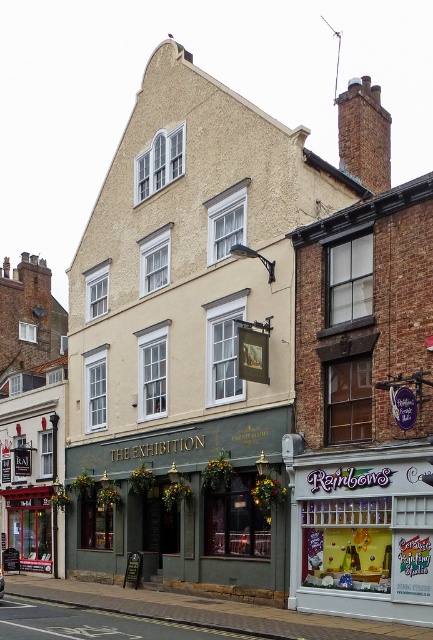
Does green matte pub at center have a smaller size compared to metallic silver car at center?

No, green matte pub at center is not smaller than metallic silver car at center.

Is green matte pub at center further to camera compared to metallic silver car at center?

Yes.

Is point (268, 522) positioned before point (2, 589)?

No, (268, 522) is further to viewer.

I want to click on green matte pub at center, so click(x=190, y=506).

I want to click on green matte pub at center, so click(190, 506).

Measure the distance between point (x=397, y=602) and camera.

The distance of point (x=397, y=602) from camera is 102.97 feet.

Find the location of a particular element. The width and height of the screenshot is (433, 640). white frosted glass at lower right is located at coordinates (361, 531).

You are a GUI agent. You are given a task and a screenshot of the screen. Output one action in this format:
    pyautogui.click(x=<x>, y=<y>)
    Task: Click on the white frosted glass at lower right
    This screenshot has width=433, height=640.
    Given the screenshot: What is the action you would take?
    pyautogui.click(x=361, y=531)

Identify the location of white frosted glass at lower right. Image resolution: width=433 pixels, height=640 pixels. (361, 531).